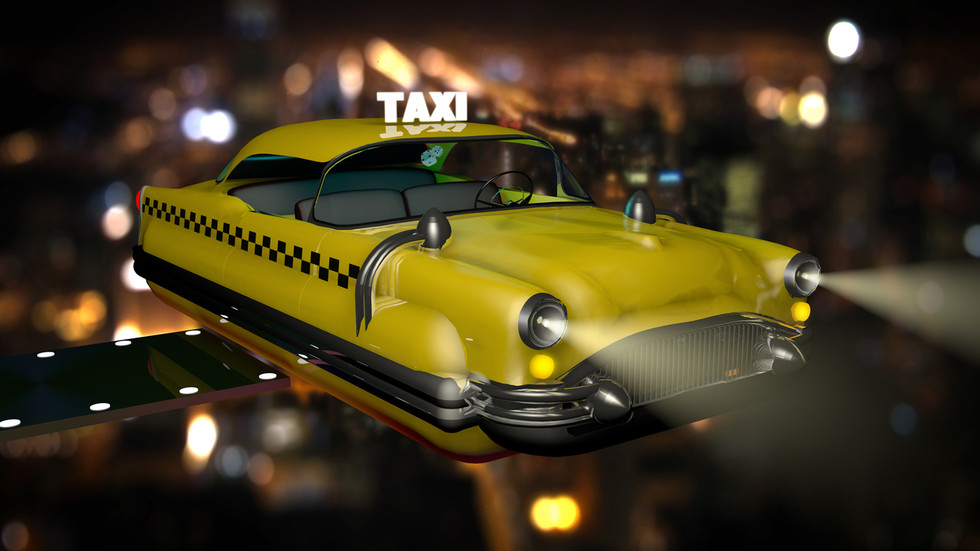
This screenshot has width=980, height=551. I want to click on checker decoration, so click(265, 242).